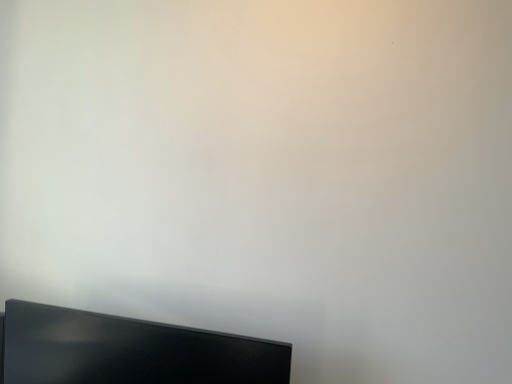
Find the location of `black glossy television at lower left`. black glossy television at lower left is located at coordinates (129, 351).

In order to face black glossy television at lower left, should I rotate leftwards or rightwards?

To face it directly, rotate left by 15.652 degrees.

Image resolution: width=512 pixels, height=384 pixels. Describe the element at coordinates (129, 351) in the screenshot. I see `black glossy television at lower left` at that location.

This screenshot has width=512, height=384. Find the location of `black glossy television at lower left`. black glossy television at lower left is located at coordinates (129, 351).